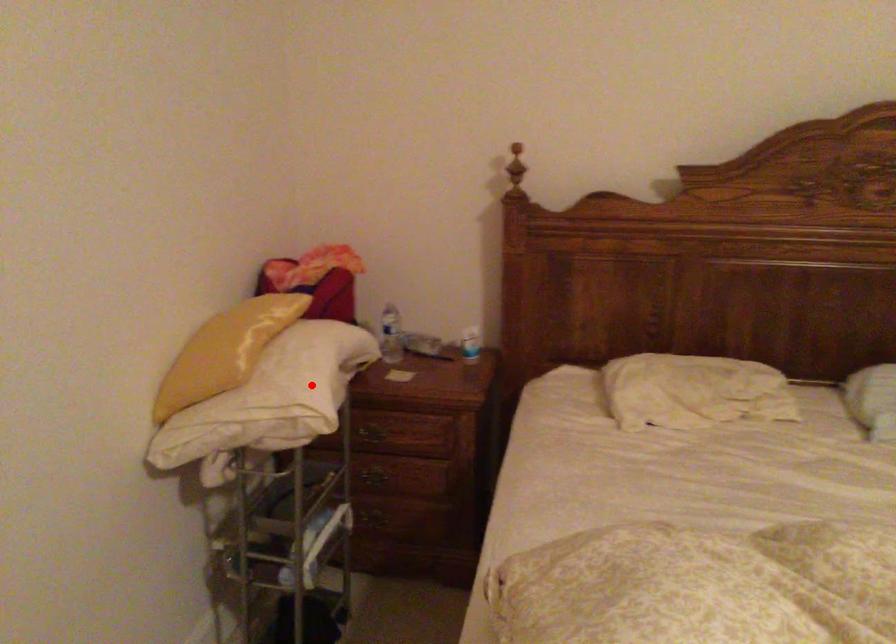
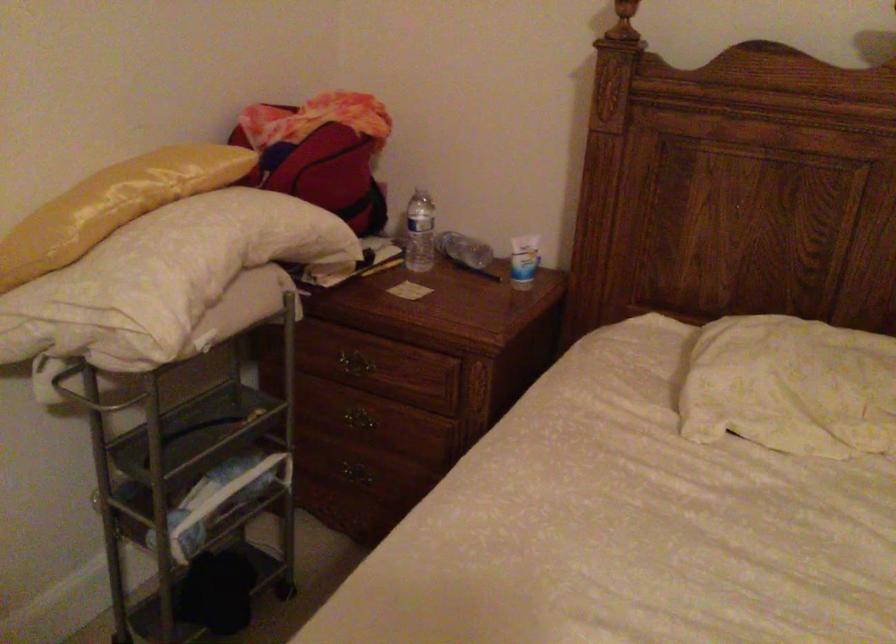
Question: I am providing you with two images of the same scene from different viewpoints. A red point is shown in image1. For the corresponding object point in image2, is it positioned nearer or farther from the camera?

Choices:
 (A) Nearer
 (B) Farther

Answer: (A)